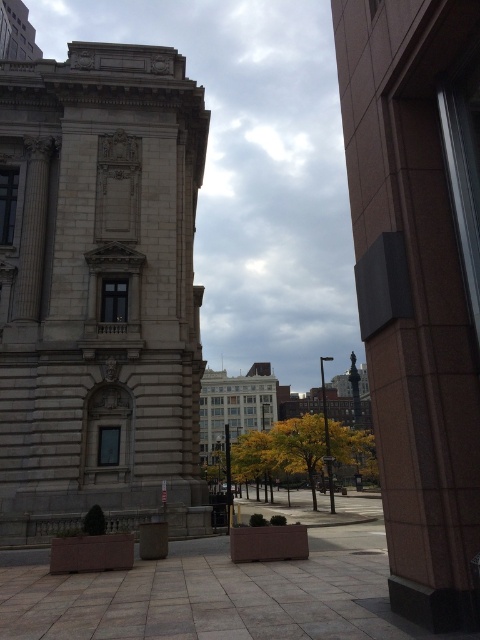
Question: Which of the following is the farthest from the observer?

Choices:
 (A) (214, 472)
 (B) (81, 492)

Answer: (A)

Question: Is light beige stone tower at left to the right of yellow leafy tree at center from the viewer's perspective?

Choices:
 (A) yes
 (B) no

Answer: (B)

Question: Does light beige stone tower at left have a lesser width compared to yellow leafy tree at center?

Choices:
 (A) no
 (B) yes

Answer: (B)

Question: Considering the relative positions of light beige stone tower at left and yellow leafy tree at center in the image provided, where is light beige stone tower at left located with respect to yellow leafy tree at center?

Choices:
 (A) left
 (B) right

Answer: (A)

Question: Which of the following is the farthest from the observer?

Choices:
 (A) light beige stone tower at left
 (B) yellow leafy tree at center

Answer: (B)

Question: Among these objects, which one is nearest to the camera?

Choices:
 (A) light beige stone tower at left
 (B) yellow leafy tree at center

Answer: (A)